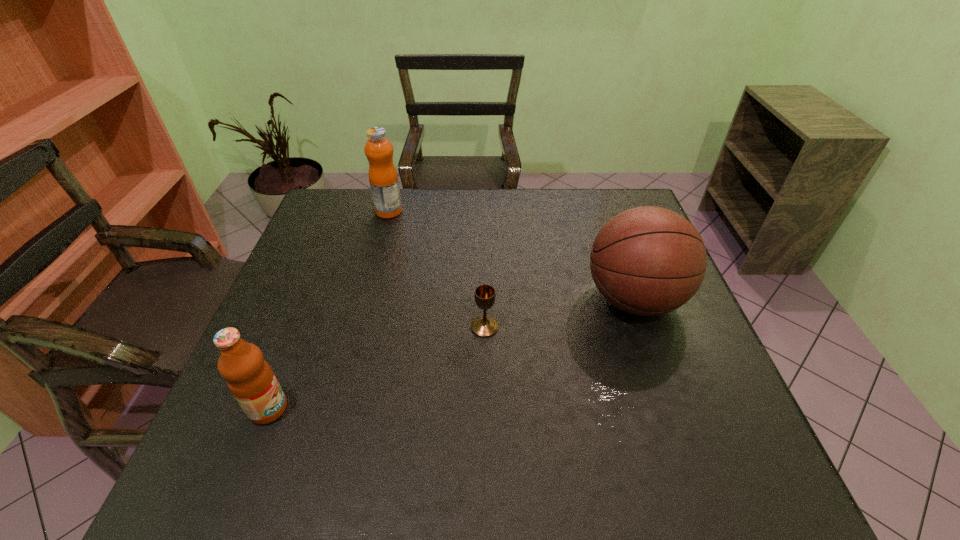
Where is `vacant point located on the right of the shortest object`? vacant point located on the right of the shortest object is located at coordinates (605, 327).

The width and height of the screenshot is (960, 540). Identify the location of object that is at the far edge. (383, 178).

Locate an element on the screen. This screenshot has height=540, width=960. object at the left edge is located at coordinates (249, 377).

This screenshot has width=960, height=540. I want to click on object that is at the right edge, so click(x=648, y=260).

At what (x,y) coordinates should I click in order to perform the action: click on vacant space at the far edge. Please return your answer as a coordinate pair (x, y). Looking at the image, I should click on (497, 212).

This screenshot has height=540, width=960. Identify the location of vacant space at the near edge of the desktop. (641, 458).

At what (x,y) coordinates should I click in order to perform the action: click on free spot at the left edge of the desktop. Please return your answer as a coordinate pair (x, y). This screenshot has width=960, height=540. Looking at the image, I should click on (348, 242).

I want to click on free region at the right edge, so click(652, 348).

Image resolution: width=960 pixels, height=540 pixels. I want to click on vacant space at the far left corner of the desktop, so click(350, 224).

Where is `free space at the near right corner`? The height and width of the screenshot is (540, 960). free space at the near right corner is located at coordinates (713, 478).